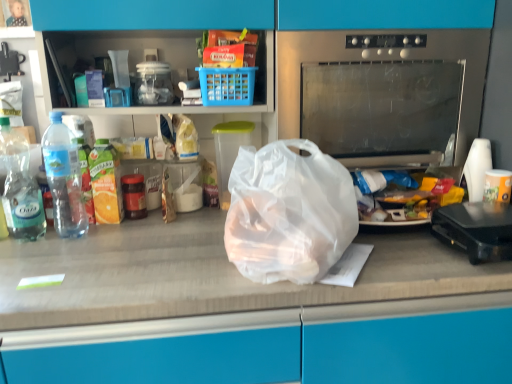
You are a GUI agent. You are given a task and a screenshot of the screen. Output one action in this format:
    pyautogui.click(x=<x>, y=<y>)
    Task: Click on the vacant area on top of translucent plastic bag at center (from a real-world perspective)
    The height and width of the screenshot is (384, 512).
    Given the screenshot: What is the action you would take?
    pyautogui.click(x=170, y=244)